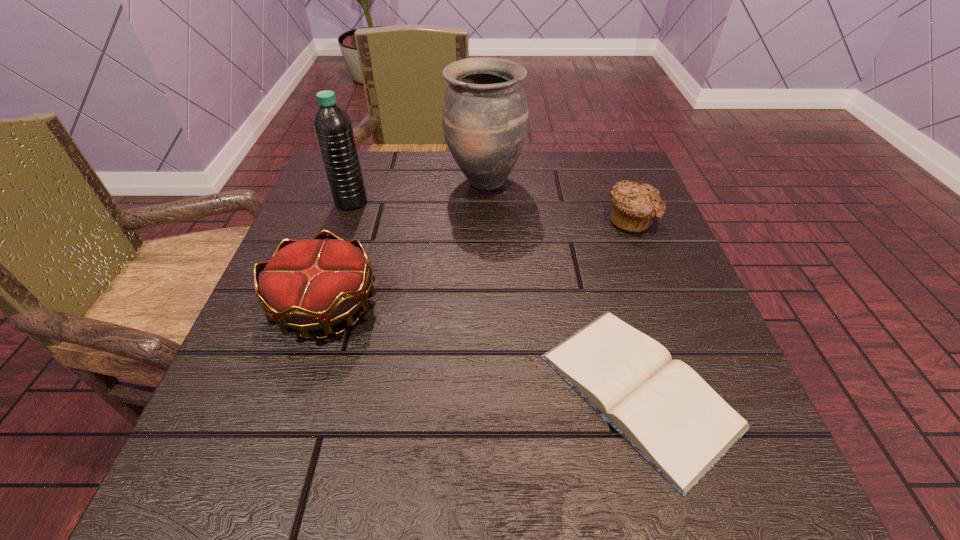
This screenshot has width=960, height=540. In order to click on urn that is at the far edge in this screenshot , I will do `click(485, 114)`.

What are the coordinates of `water bottle that is at the far edge` in the screenshot? It's located at (332, 125).

You are a GUI agent. You are given a task and a screenshot of the screen. Output one action in this format:
    pyautogui.click(x=<x>, y=<y>)
    Task: Click on the muffin located at the far edge
    This screenshot has height=540, width=960.
    Given the screenshot: What is the action you would take?
    pyautogui.click(x=634, y=206)

What are the coordinates of `object that is at the near edge` in the screenshot? It's located at (661, 407).

The image size is (960, 540). Find the location of `water bottle situated at the left edge`. water bottle situated at the left edge is located at coordinates (332, 125).

You are a GUI agent. You are given a task and a screenshot of the screen. Output one action in this format:
    pyautogui.click(x=<x>, y=<y>)
    Task: Click on the crown that is at the left edge
    
    Given the screenshot: What is the action you would take?
    pyautogui.click(x=312, y=284)

Find the location of `muffin located in the right edge section of the desktop`. muffin located in the right edge section of the desktop is located at coordinates pos(634,206).

I want to click on Bible at the right edge, so click(661, 407).

Find the location of a particular element. This screenshot has height=540, width=960. object located at the far left corner is located at coordinates (332, 125).

Locate an element on the screen. Image resolution: width=960 pixels, height=540 pixels. object positioned at the far right corner is located at coordinates (634, 206).